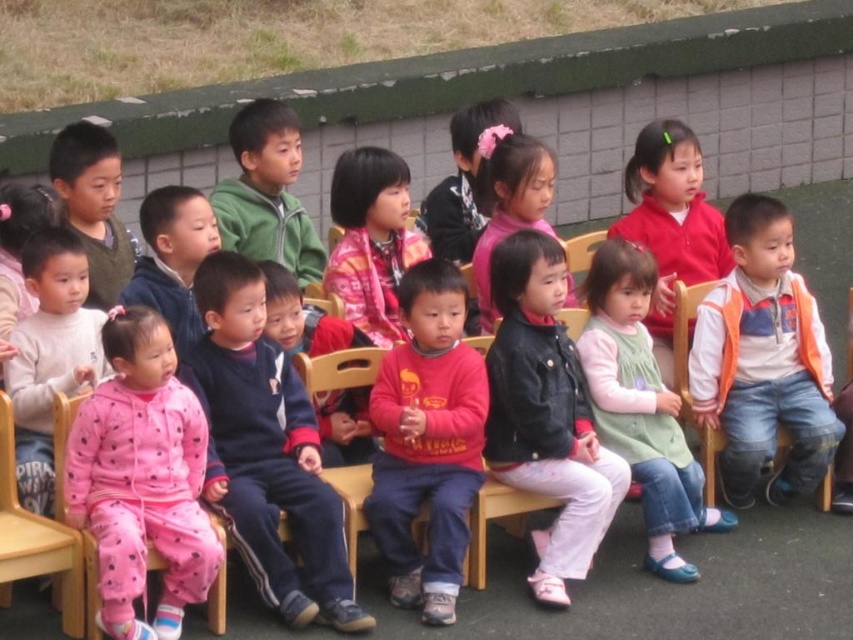
Question: Which of the following is the farthest from the observer?

Choices:
 (A) (393, 188)
 (B) (544, 296)
 (C) (437, 605)

Answer: (A)

Question: Considering the real-world distances, which object is farthest from the plaid fabric shirt at center?

Choices:
 (A) pink fleece pajamas at lower left
 (B) matte blue jacket at center
 (C) denim jacket at center
 (D) orange fleece vest at right

Answer: (D)

Question: Does orange fleece vest at right have a lesser width compared to red matte jacket at center?

Choices:
 (A) yes
 (B) no

Answer: (B)

Question: Which object is the closest to the red matte jacket at center?

Choices:
 (A) pink fleece jacket at center
 (B) pink fleece pajamas at lower left
 (C) denim jacket at center
 (D) matte green jacket at upper left

Answer: (A)

Question: Can you confirm if dark blue fleece jacket at center is wider than red matte sweater at center?

Choices:
 (A) no
 (B) yes

Answer: (B)

Question: In this image, where is matte green jacket at upper left located relative to wooden chair at lower left?

Choices:
 (A) below
 (B) above

Answer: (B)